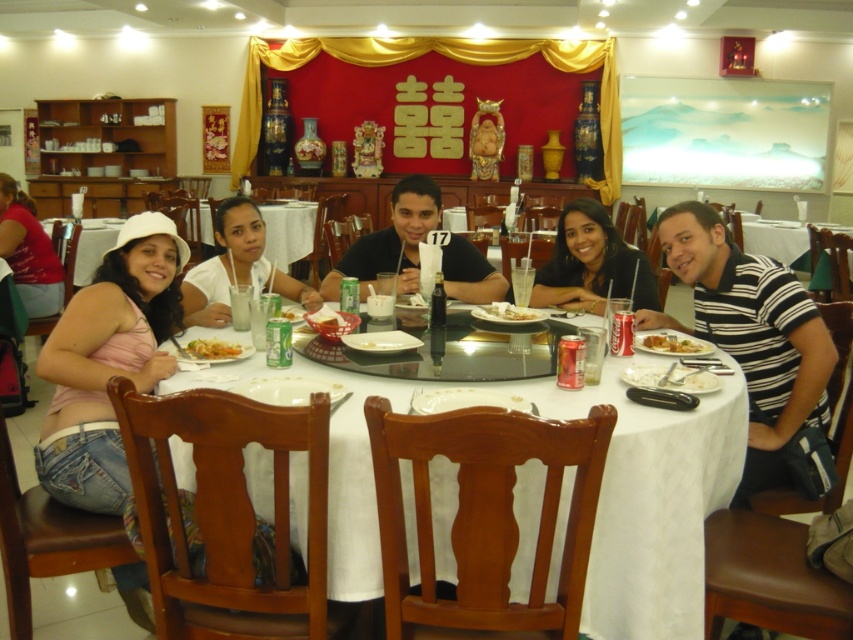
Question: Which object appears farthest from the camera in this image?

Choices:
 (A) matte black hair at center
 (B) white wood table at center
 (C) white matte plate at center
 (D) matte red shirt at left

Answer: (D)

Question: Does matte black shirt at center have a lesser width compared to white matte plate at center?

Choices:
 (A) yes
 (B) no

Answer: (B)

Question: Which point appears farthest from the camera in this image?

Choices:
 (A) (669, 344)
 (B) (387, 248)
 (C) (602, 563)
 (D) (224, 198)

Answer: (B)

Question: Is shiny plastic fork at lower right below white matte plate at center?

Choices:
 (A) no
 (B) yes

Answer: (B)

Question: Can you confirm if black striped shirt at right is smaller than yellow fried noodles at table center?

Choices:
 (A) yes
 (B) no

Answer: (B)

Question: Which object is farther from the camera taking this photo?

Choices:
 (A) shiny plastic fork at lower right
 (B) matte black hair at center
 (C) black striped shirt at right

Answer: (B)